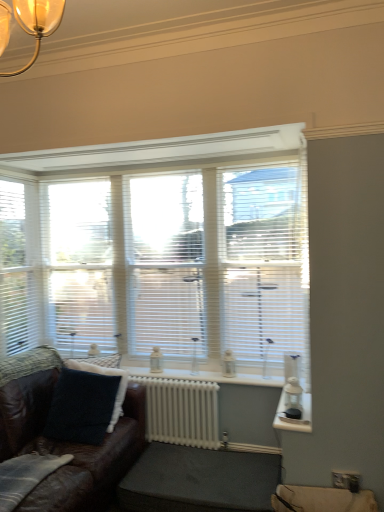
Question: Is white blinds at center thinner than white painted metal radiator at center?

Choices:
 (A) yes
 (B) no

Answer: (B)

Question: Can you confirm if white blinds at center is bigger than white painted metal radiator at center?

Choices:
 (A) yes
 (B) no

Answer: (A)

Question: Is white blinds at center oriented away from white painted metal radiator at center?

Choices:
 (A) yes
 (B) no

Answer: (B)

Question: From a real-world perspective, is white blinds at center physically above white painted metal radiator at center?

Choices:
 (A) yes
 (B) no

Answer: (A)

Question: Does white blinds at center have a smaller size compared to white painted metal radiator at center?

Choices:
 (A) no
 (B) yes

Answer: (A)

Question: From the image's perspective, is white blinds at center below white painted metal radiator at center?

Choices:
 (A) no
 (B) yes

Answer: (A)

Question: From the image's perspective, is dark gray fabric footrest at lower center below white blinds at center?

Choices:
 (A) no
 (B) yes

Answer: (B)

Question: Is dark gray fabric footrest at lower center with white blinds at center?

Choices:
 (A) yes
 (B) no

Answer: (B)

Question: Is dark gray fabric footrest at lower center aimed at white blinds at center?

Choices:
 (A) yes
 (B) no

Answer: (B)

Question: Considering the relative sizes of dark gray fabric footrest at lower center and white blinds at center in the image provided, is dark gray fabric footrest at lower center smaller than white blinds at center?

Choices:
 (A) yes
 (B) no

Answer: (A)

Question: Is dark gray fabric footrest at lower center completely or partially outside of white blinds at center?

Choices:
 (A) no
 (B) yes

Answer: (B)

Question: Considering the relative sizes of dark gray fabric footrest at lower center and white blinds at center in the image provided, is dark gray fabric footrest at lower center wider than white blinds at center?

Choices:
 (A) yes
 (B) no

Answer: (A)

Question: From the image's perspective, does transparent plastic glass door at center appear higher than white painted metal radiator at center?

Choices:
 (A) no
 (B) yes

Answer: (B)